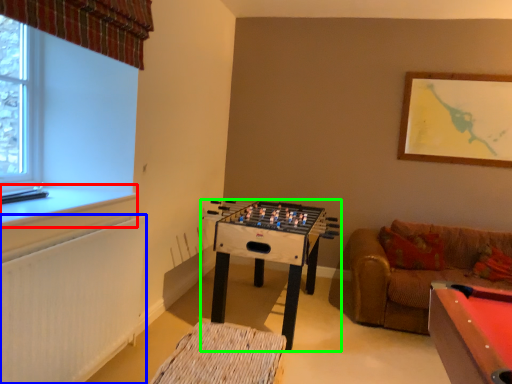
Question: Estimate the real-world distances between objects in this image. Which object is farther from window sill (highlighted by a red box), radiator (highlighted by a blue box) or table (highlighted by a green box)?

Choices:
 (A) radiator
 (B) table

Answer: (B)